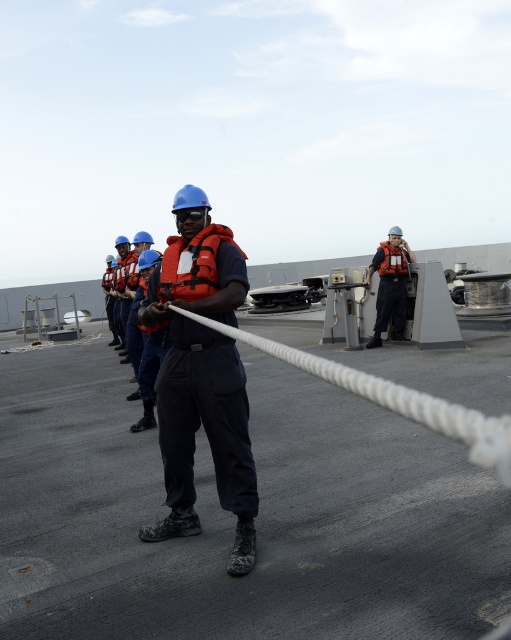
Question: Which of the following is the farthest from the observer?

Choices:
 (A) orange matte safety vest at center
 (B) white rope at center

Answer: (A)

Question: Is orange life vest at center to the left of orange matte safety vest at center from the viewer's perspective?

Choices:
 (A) yes
 (B) no

Answer: (A)

Question: Can you confirm if white rope at center is positioned above orange matte safety vest at center?

Choices:
 (A) no
 (B) yes

Answer: (A)

Question: Among these objects, which one is nearest to the camera?

Choices:
 (A) orange matte safety vest at center
 (B) orange life vest at center

Answer: (B)

Question: In this image, where is orange life vest at center located relative to orange matte safety vest at center?

Choices:
 (A) right
 (B) left

Answer: (B)

Question: Which object is positioned farthest from the orange life vest at center?

Choices:
 (A) orange matte safety vest at center
 (B) white rope at center

Answer: (A)